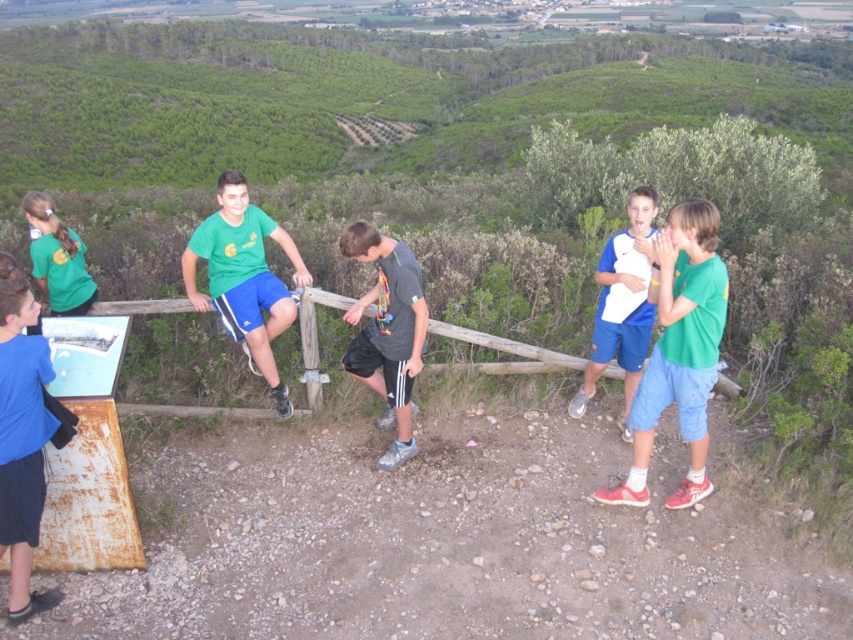
Based on the photo, does green matte t-shirt at center come behind dark gray fabric shorts at center?

Yes, it is.

Is green matte t-shirt at center shorter than dark gray fabric shorts at center?

Incorrect, green matte t-shirt at center's height does not fall short of dark gray fabric shorts at center's.

Between point (260, 333) and point (381, 364), which one is positioned in front?

Point (381, 364) is in front.

Find the location of a particular element. green matte t-shirt at center is located at coordinates (244, 278).

Where is `green matte shirt at right`? This screenshot has height=640, width=853. green matte shirt at right is located at coordinates (679, 349).

Is point (654, 259) positioned after point (397, 342)?

No, it is not.

This screenshot has height=640, width=853. What are the coordinates of `green matte shirt at right` in the screenshot? It's located at (679, 349).

Is the position of green matte t-shirt at center more distant than that of blue fabric shirt at right?

Yes, green matte t-shirt at center is behind blue fabric shirt at right.

Is point (247, 305) closer to camera compared to point (643, 260)?

That is False.

The height and width of the screenshot is (640, 853). In order to click on green matte t-shirt at center in this screenshot , I will do `click(244, 278)`.

Where is `green matte t-shirt at center`? green matte t-shirt at center is located at coordinates (244, 278).